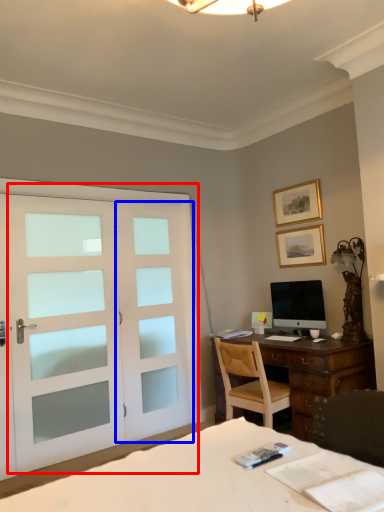
Question: Among these objects, which one is farthest to the camera, door (highlighted by a red box) or screen door (highlighted by a blue box)?

Choices:
 (A) door
 (B) screen door

Answer: (B)